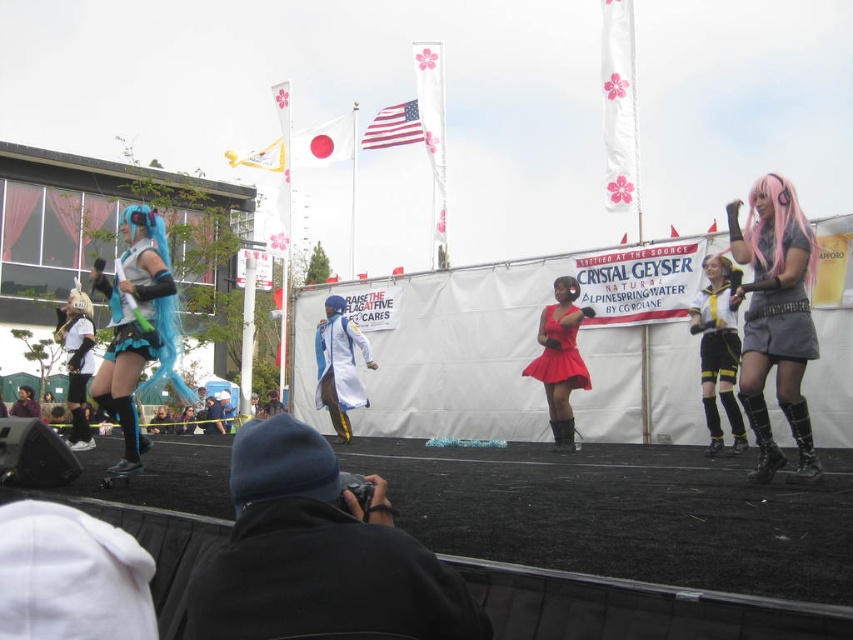
Question: Does pink matte wig at right have a smaller size compared to pink synthetic wig at upper right?

Choices:
 (A) no
 (B) yes

Answer: (B)

Question: Which object is closer to the camera taking this photo?

Choices:
 (A) yellow and black striped shorts at center
 (B) shiny blue fabric dress at left
 (C) shiny blue wig at left
 (D) pink synthetic wig at upper right

Answer: (D)

Question: Which point is closer to the camera?

Choices:
 (A) pink matte wig at right
 (B) matte gray skirt at right

Answer: (A)

Question: Can you confirm if matte red dress at center is positioned above shiny red skirt at center?

Choices:
 (A) yes
 (B) no

Answer: (B)

Question: Which point is farther from the camera taking this photo?

Choices:
 (A) (778, 352)
 (B) (759, 349)

Answer: (B)

Question: Can you confirm if yellow and black striped shorts at center is bigger than shiny red skirt at center?

Choices:
 (A) no
 (B) yes

Answer: (A)